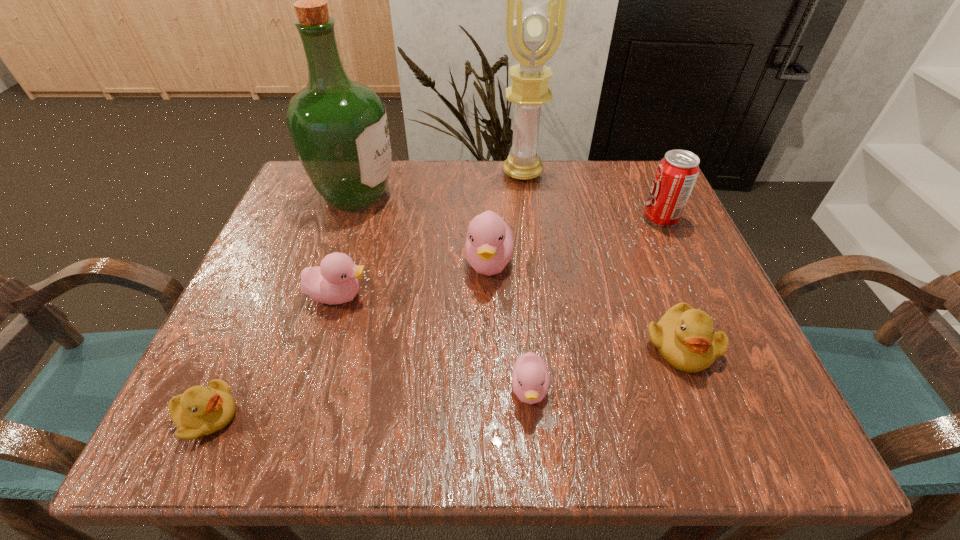
You are a GUI agent. You are given a task and a screenshot of the screen. Output one action in this format:
    pyautogui.click(x=<x>, y=<y>)
    Task: Click on the award located in the far edge section of the desktop
    The width and height of the screenshot is (960, 540).
    Given the screenshot: What is the action you would take?
    pyautogui.click(x=534, y=34)

This screenshot has width=960, height=540. I want to click on soda that is positioned at the far edge, so click(x=676, y=174).

Where is `liquor located at the left edge`? The height and width of the screenshot is (540, 960). liquor located at the left edge is located at coordinates (339, 128).

You are a GUI agent. You are given a task and a screenshot of the screen. Output one action in this format:
    pyautogui.click(x=<x>, y=<y>)
    Task: Click on the soda positioned at the right edge
    
    Given the screenshot: What is the action you would take?
    pyautogui.click(x=676, y=174)

You are a GUI agent. You are given a task and a screenshot of the screen. Output one action in this format:
    pyautogui.click(x=<x>, y=<y>)
    Task: Click on the duckling present at the right edge
    The image size is (960, 540).
    Given the screenshot: What is the action you would take?
    pyautogui.click(x=685, y=337)

You are a GUI agent. You are given a task and a screenshot of the screen. Output one action in this format:
    pyautogui.click(x=<x>, y=<y>)
    Task: Click on the object positioned at the far left corner
    The height and width of the screenshot is (540, 960).
    Given the screenshot: What is the action you would take?
    pyautogui.click(x=339, y=128)

Where is `object located at the near left corner`? The height and width of the screenshot is (540, 960). object located at the near left corner is located at coordinates (200, 410).

Identify the location of object located in the far right corner section of the desktop. Image resolution: width=960 pixels, height=540 pixels. (676, 174).

You are a GUI agent. You are given a task and a screenshot of the screen. Output one action in this format:
    pyautogui.click(x=<x>, y=<y>)
    Task: Click on the free region at the far edge
    The width and height of the screenshot is (960, 540).
    Given the screenshot: What is the action you would take?
    pyautogui.click(x=596, y=207)

This screenshot has height=540, width=960. Identify the location of vacant area at the near edge. (416, 426).